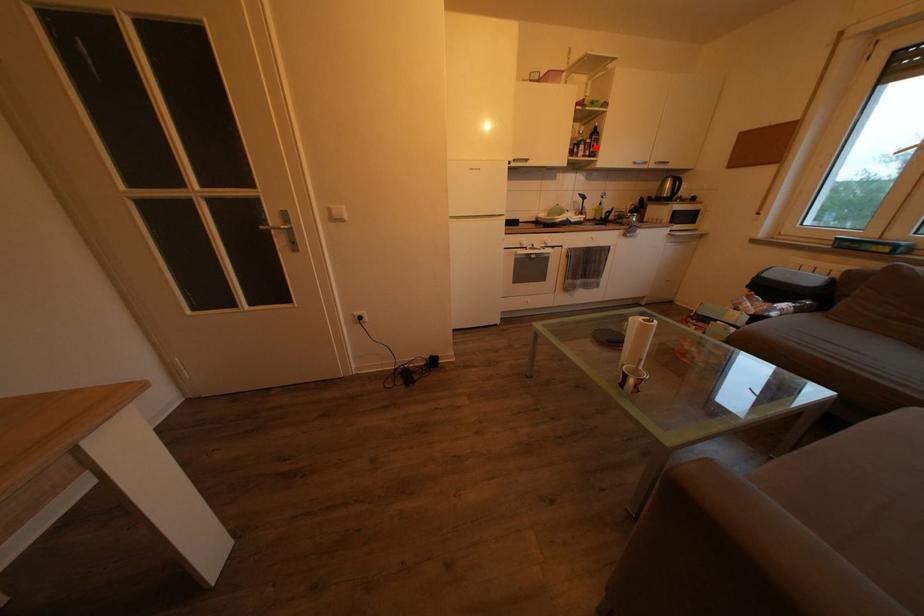
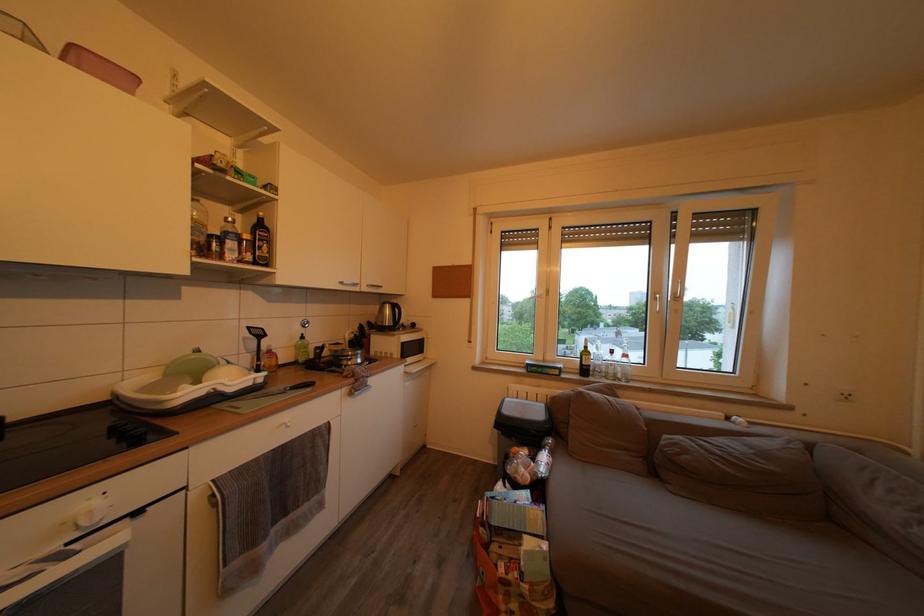
Locate, in the second image, the point that corresponds to the highlighted location in the first image.

(253, 243)